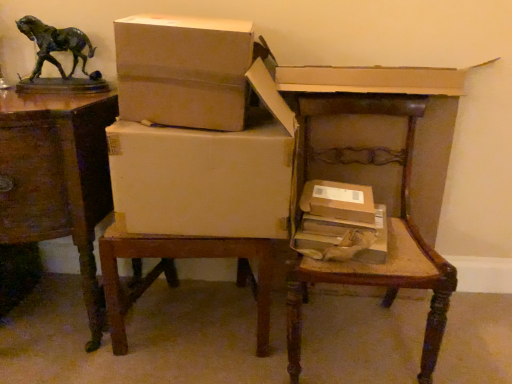
Question: Is white cardboard box at center, the first box in the top-to-bottom sequence, oriented towards wooden chair at center?

Choices:
 (A) no
 (B) yes

Answer: (A)

Question: From a real-world perspective, is white cardboard box at center, placed as the fourth box when sorted from bottom to top, beneath wooden chair at center?

Choices:
 (A) no
 (B) yes

Answer: (A)

Question: Considering the relative sizes of white cardboard box at center, placed as the fourth box when sorted from bottom to top, and wooden chair at center in the image provided, is white cardboard box at center, placed as the fourth box when sorted from bottom to top, smaller than wooden chair at center?

Choices:
 (A) yes
 (B) no

Answer: (A)

Question: From a real-world perspective, is white cardboard box at center, the first box in the top-to-bottom sequence, on wooden chair at center?

Choices:
 (A) no
 (B) yes

Answer: (B)

Question: Can you confirm if white cardboard box at center, placed as the fourth box when sorted from bottom to top, is taller than wooden chair at center?

Choices:
 (A) no
 (B) yes

Answer: (A)

Question: From a real-world perspective, is wooden table at left physically located above or below white cardboard box at center, which appears as the second box when viewed from the top?

Choices:
 (A) above
 (B) below

Answer: (B)

Question: Based on their sizes in the image, would you say wooden table at left is bigger or smaller than white cardboard box at center, the third box when ordered from bottom to top?

Choices:
 (A) small
 (B) big

Answer: (B)

Question: Is wooden table at left in front of or behind white cardboard box at center, which appears as the second box when viewed from the top, in the image?

Choices:
 (A) front
 (B) behind

Answer: (A)

Question: Is point (77, 162) closer or farther from the camera than point (170, 192)?

Choices:
 (A) farther
 (B) closer

Answer: (A)

Question: Considering the positions of brown cardboard box at lower right, the fourth box viewed from the top, and brown cardboard box at center, which is counted as the 3th box, starting from the top, in the image, is brown cardboard box at lower right, the fourth box viewed from the top, wider or thinner than brown cardboard box at center, which is counted as the 3th box, starting from the top,?

Choices:
 (A) wide
 (B) thin

Answer: (A)

Question: Is brown cardboard box at lower right, the fourth box viewed from the top, inside or outside of brown cardboard box at center, positioned as the second box in bottom-to-top order?

Choices:
 (A) outside
 (B) inside

Answer: (A)

Question: Based on their sizes in the image, would you say brown cardboard box at lower right, arranged as the 1th box when ordered from the bottom, is bigger or smaller than brown cardboard box at center, positioned as the second box in bottom-to-top order?

Choices:
 (A) small
 (B) big

Answer: (B)

Question: From the image's perspective, relative to brown cardboard box at center, positioned as the second box in bottom-to-top order, is brown cardboard box at lower right, the fourth box viewed from the top, above or below?

Choices:
 (A) below
 (B) above

Answer: (A)

Question: In terms of height, does white cardboard box at center, which appears as the second box when viewed from the top, look taller or shorter compared to bronze horse at upper left?

Choices:
 (A) short
 (B) tall

Answer: (B)

Question: Considering the positions of point (x=164, y=182) and point (x=56, y=46), is point (x=164, y=182) closer or farther from the camera than point (x=56, y=46)?

Choices:
 (A) farther
 (B) closer

Answer: (B)